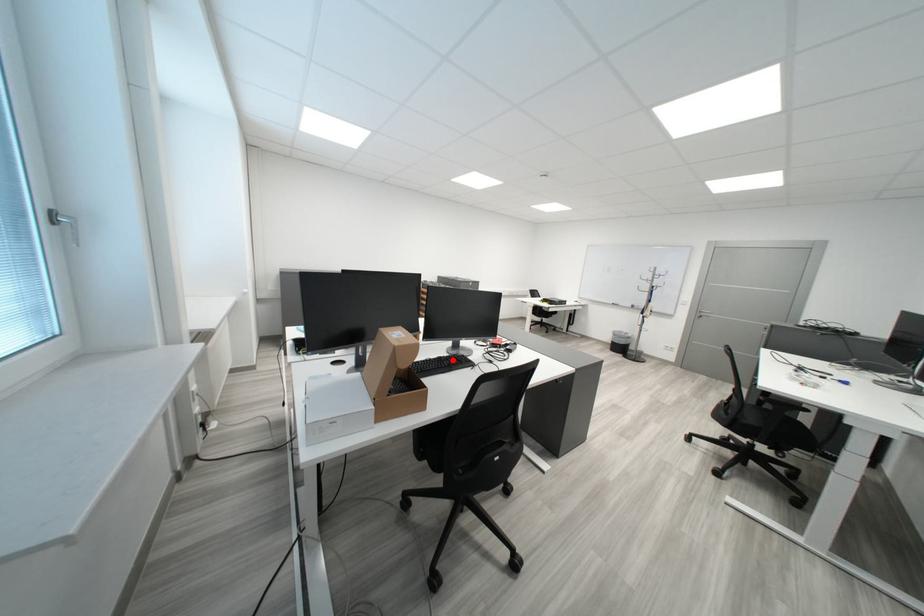
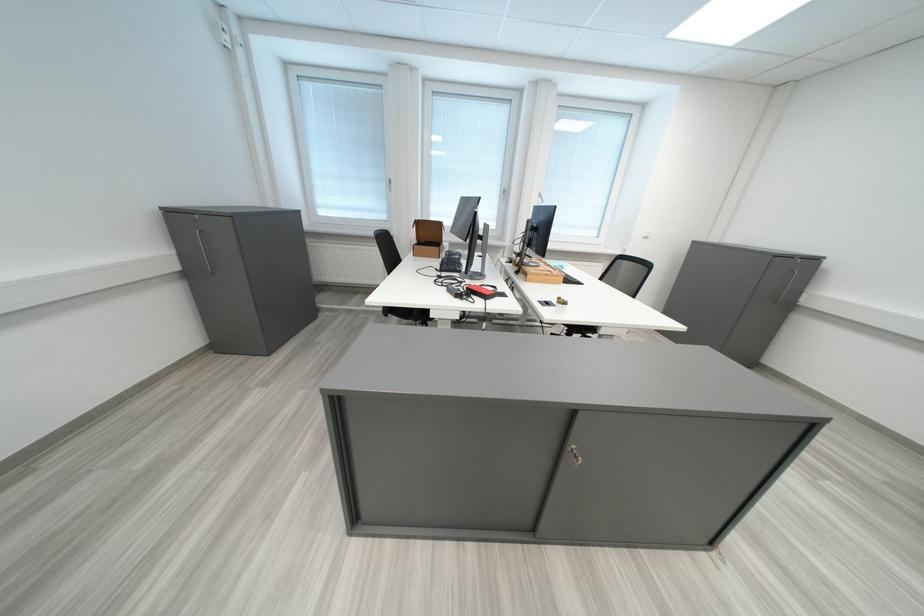
Question: I am providing you with two images of the same scene from different viewpoints. A red point is marked on the first image. At the location where the point appears in image 1, is it still visible in image 2?

Choices:
 (A) Yes
 (B) No

Answer: (B)